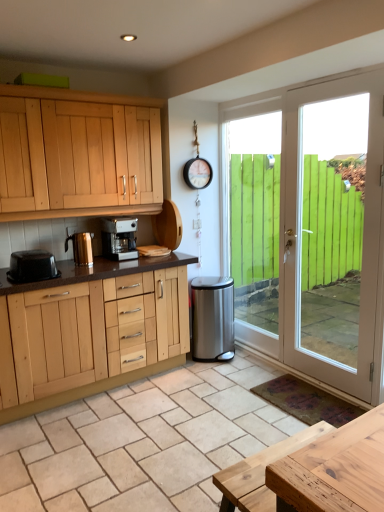
Question: Is the position of stainless steel trash can at lower right less distant than that of white glossy door at right?

Choices:
 (A) no
 (B) yes

Answer: (A)

Question: Is stainless steel trash can at lower right behind white glossy door at right?

Choices:
 (A) no
 (B) yes

Answer: (B)

Question: Are stainless steel trash can at lower right and white glossy door at right far apart?

Choices:
 (A) no
 (B) yes

Answer: (A)

Question: From a real-world perspective, is stainless steel trash can at lower right under white glossy door at right?

Choices:
 (A) no
 (B) yes

Answer: (B)

Question: Is stainless steel trash can at lower right to the right of white glossy door at right from the viewer's perspective?

Choices:
 (A) yes
 (B) no

Answer: (B)

Question: Based on their positions, is stainless steel trash can at lower right located to the left or right of natural wood table at lower right?

Choices:
 (A) right
 (B) left

Answer: (B)

Question: In the image, is stainless steel trash can at lower right positioned in front of or behind natural wood table at lower right?

Choices:
 (A) front
 (B) behind

Answer: (B)

Question: Considering the positions of point (198, 298) and point (314, 429), is point (198, 298) closer or farther from the camera than point (314, 429)?

Choices:
 (A) closer
 (B) farther

Answer: (B)

Question: Is stainless steel trash can at lower right inside the boundaries of natural wood table at lower right, or outside?

Choices:
 (A) outside
 (B) inside

Answer: (A)

Question: Considering the positions of stainless steel trash can at lower right and white glossy door at right in the image, is stainless steel trash can at lower right bigger or smaller than white glossy door at right?

Choices:
 (A) big
 (B) small

Answer: (B)

Question: From a real-world perspective, is stainless steel trash can at lower right physically located above or below white glossy door at right?

Choices:
 (A) below
 (B) above

Answer: (A)

Question: Which is correct: stainless steel trash can at lower right is inside white glossy door at right, or outside of it?

Choices:
 (A) outside
 (B) inside

Answer: (A)

Question: Does point (203, 287) appear closer or farther from the camera than point (271, 350)?

Choices:
 (A) closer
 (B) farther

Answer: (B)

Question: From a real-world perspective, is white glossy door at right positioned above or below shiny metallic kettle at left, which ranks as the 2th kitchen appliance in right-to-left order?

Choices:
 (A) below
 (B) above

Answer: (A)

Question: Is point (332, 358) positioned closer to the camera than point (89, 261)?

Choices:
 (A) farther
 (B) closer

Answer: (A)